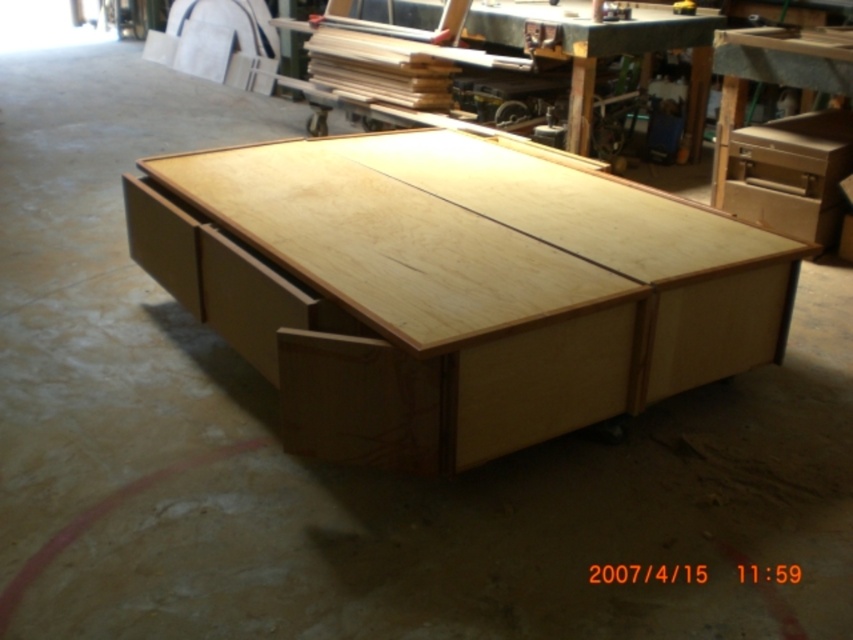
Is natural wood table at center positioned in front of natural wood drawer at center?

Yes.

Is natural wood table at center wider than natural wood drawer at center?

Indeed, natural wood table at center has a greater width compared to natural wood drawer at center.

Does point (322, 452) come farther from viewer compared to point (790, 173)?

No, it is not.

Where is `natural wood table at center`? The image size is (853, 640). natural wood table at center is located at coordinates pyautogui.click(x=463, y=289).